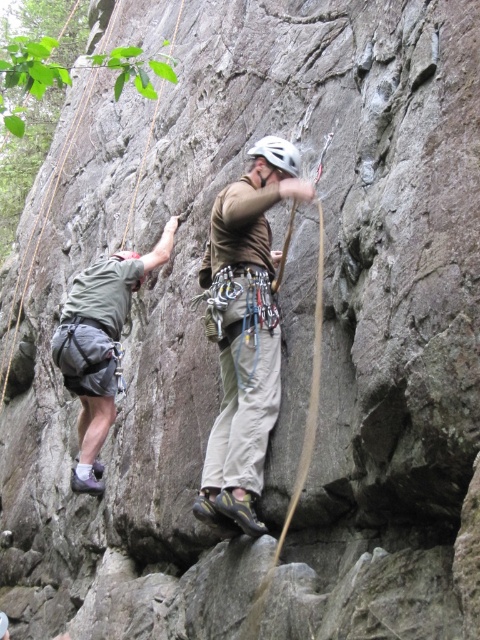
Does khaki cotton pants at center appear under white matte helmet at center?

Yes.

Who is taller, khaki cotton pants at center or white matte helmet at center?

khaki cotton pants at center

Locate an element on the screen. This screenshot has height=640, width=480. khaki cotton pants at center is located at coordinates (244, 333).

Locate an element on the screen. The image size is (480, 640). khaki cotton pants at center is located at coordinates (244, 333).

Can you confirm if gray fabric shorts at left is thinner than white matte helmet at center?

Incorrect, gray fabric shorts at left's width is not less than white matte helmet at center's.

Does point (117, 356) come closer to viewer compared to point (254, 148)?

No, (117, 356) is further to viewer.

Image resolution: width=480 pixels, height=640 pixels. What are the coordinates of `gray fabric shorts at left` in the screenshot? It's located at (99, 346).

Does khaki cotton pants at center appear under gray fabric shorts at left?

Incorrect, khaki cotton pants at center is not positioned below gray fabric shorts at left.

Does khaki cotton pants at center appear on the left side of gray fabric shorts at left?

In fact, khaki cotton pants at center is to the right of gray fabric shorts at left.

Is point (276, 344) more distant than point (166, 228)?

No.

You are a GUI agent. You are given a task and a screenshot of the screen. Output one action in this format:
    pyautogui.click(x=<x>, y=<y>)
    Task: Click on the khaki cotton pants at center
    
    Given the screenshot: What is the action you would take?
    pyautogui.click(x=244, y=333)